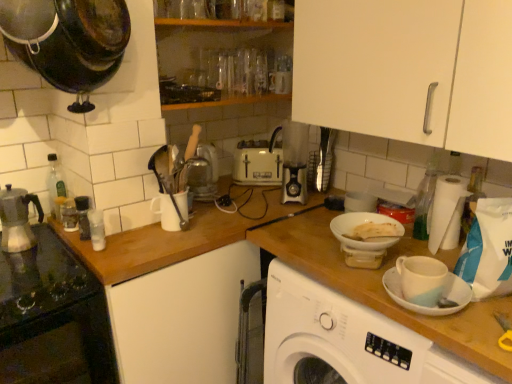
The height and width of the screenshot is (384, 512). What are the coordinates of `empty space that is to the right of translucent glass coffee machine at center` in the screenshot? It's located at (242, 190).